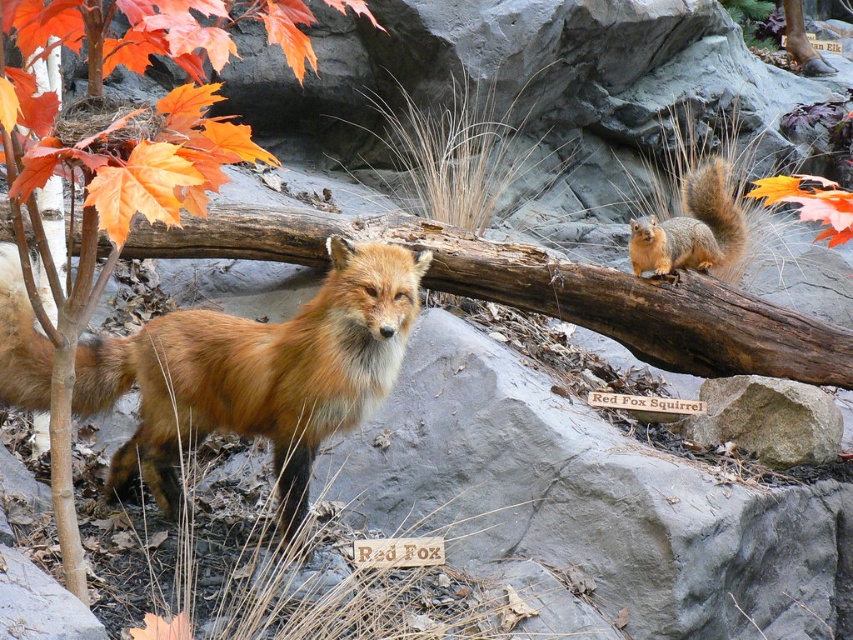
Question: Which object appears farthest from the camera in this image?

Choices:
 (A) orange matte leaf at upper left
 (B) gray rock at center
 (C) shiny reddish-brown fur at center

Answer: (B)

Question: Can you confirm if shiny reddish-brown fur at center is smaller than orange leafy tree at lower left?

Choices:
 (A) yes
 (B) no

Answer: (A)

Question: Which point is closer to the camera?

Choices:
 (A) click(795, 198)
 (B) click(401, 330)
 (C) click(733, 444)

Answer: (A)

Question: Which point is closer to the camera taking this photo?

Choices:
 (A) (102, 218)
 (B) (90, 400)

Answer: (A)

Question: Is shiny reddish-brown fur at center positioned before gray rock at center?

Choices:
 (A) no
 (B) yes

Answer: (B)

Question: Does orange leafy tree at lower left come in front of gray rock at center?

Choices:
 (A) no
 (B) yes

Answer: (B)